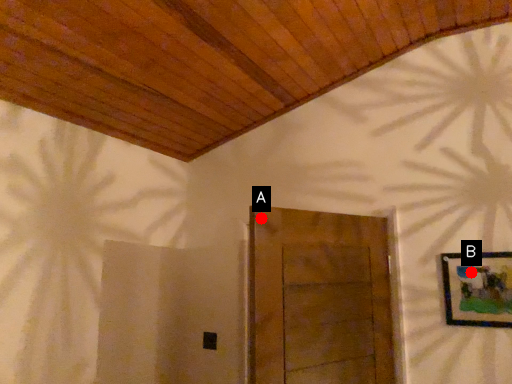
Question: Two points are circled on the image, labeled by A and B beside each circle. Which point is closer to the camera taking this photo?

Choices:
 (A) A is closer
 (B) B is closer

Answer: (A)